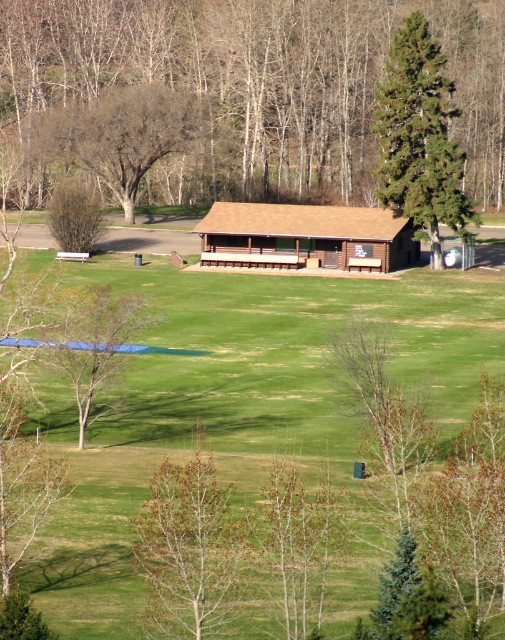
Question: Which point is closer to the camera?

Choices:
 (A) (80, 202)
 (B) (448, 3)
 (C) (249, 221)

Answer: (C)

Question: In this image, where is green leafy tree at center located relative to brown leafy tree at upper left?

Choices:
 (A) left
 (B) right

Answer: (B)

Question: Is brown leafy tree at lower center bigger than green textured pine tree at right?

Choices:
 (A) yes
 (B) no

Answer: (B)

Question: Which object is the farthest from the green leafy bush at left?

Choices:
 (A) brown leafy tree at upper left
 (B) green textured pine tree at right
 (C) brown wooden cabin at center

Answer: (B)

Question: Which object is the farthest from the brown smooth tree at lower center?

Choices:
 (A) brown leafless tree at lower left
 (B) green leafy bush at left
 (C) brown leafy tree at upper left

Answer: (C)

Question: Is brown leafless tree at lower left thinner than green leafy bush at left?

Choices:
 (A) yes
 (B) no

Answer: (B)